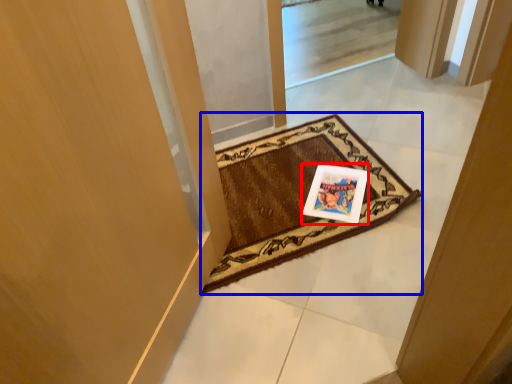
Question: Which point is closer to the camera, postcard (highlighted by a red box) or mat (highlighted by a blue box)?

Choices:
 (A) postcard
 (B) mat

Answer: (B)